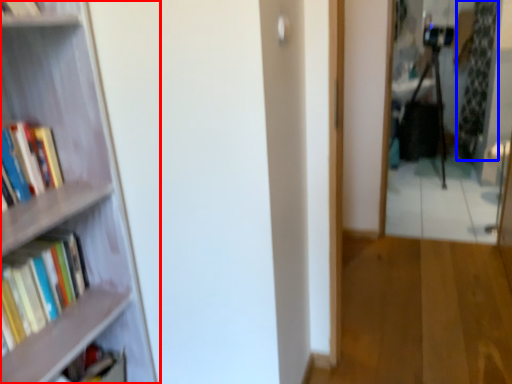
Question: Among these objects, which one is nearest to the camera, bookcase (highlighted by a red box) or curtain (highlighted by a blue box)?

Choices:
 (A) bookcase
 (B) curtain

Answer: (A)